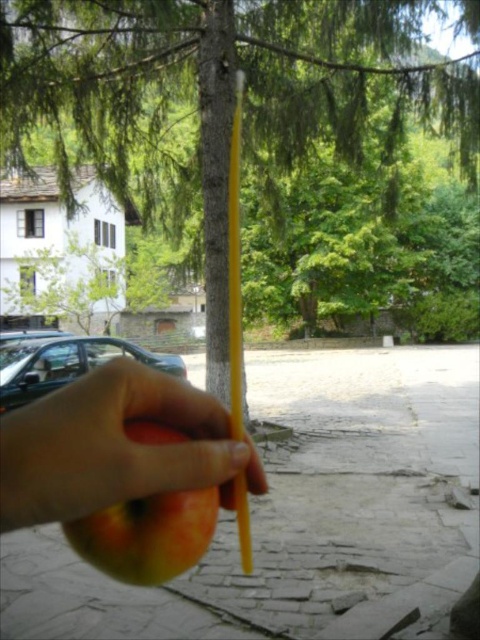
Based on the photo, you are standing at the cobblestone pathway in the park. You see two points marked on the ground at coordinates point [132,1] and point [87,460]. Which point is closer to the building with white walls?

Point [132,1] is behind point [87,460], so the point closer to the building with white walls is point [132,1].

You are an artist sketching in the park. You notice the green textured tree at center and the ripe yellow apple at center. Which object would require more space on your paper to accurately depict its size?

The green textured tree at center is bigger than the ripe yellow apple at center, so it would require more space on the paper to accurately depict its size.